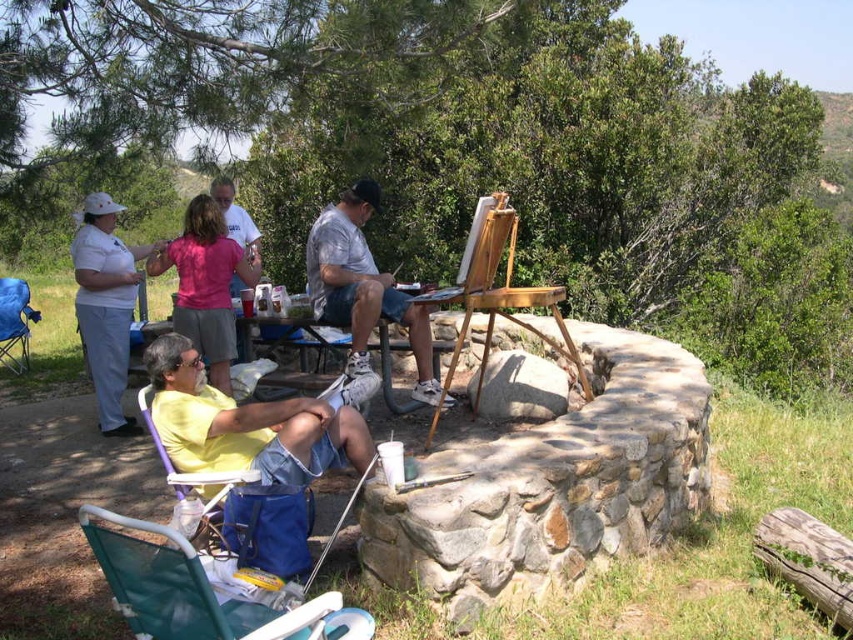
Looking at this image, you are an artist standing at the edge of the stone structure in the outdoor scene. You need to reach both the matte gray shirt at center and the wooden easel at center. Which object will you encounter first as you move forward?

You will encounter the matte gray shirt at center first because it is closer to you than the wooden easel at center, which is further away.

You are an artist carrying a large canvas that is 24 inches wide. You need to place it between the matte gray shirt at center and the wooden easel at center. Is there enough space to fit the canvas without overlapping either object?

The distance between the matte gray shirt at center and the wooden easel at center is 22.51 inches. Since the canvas is 24 inches wide, it would not fit between them without overlapping either object.